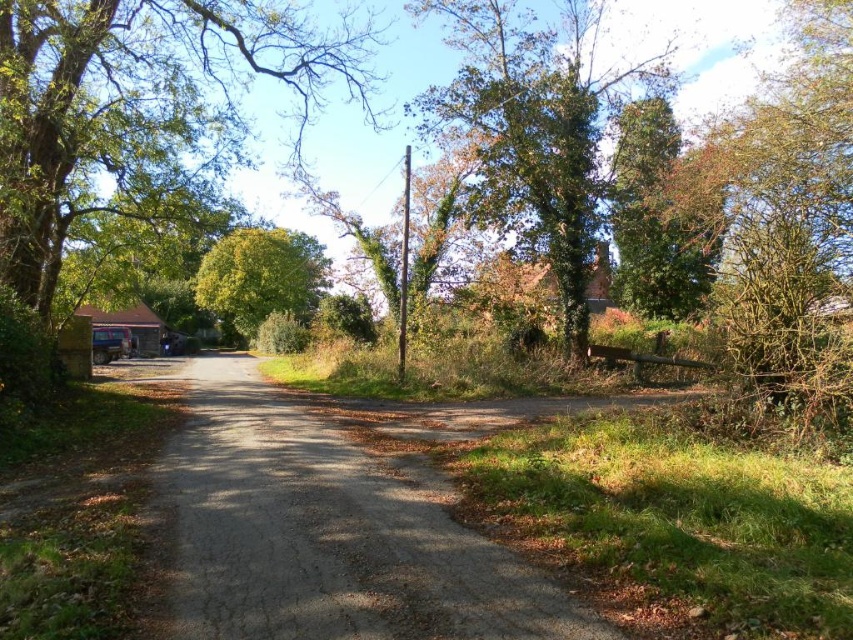
In the scene shown: Can you confirm if green leafy tree at left is smaller than green leafy tree at center?

Actually, green leafy tree at left might be larger than green leafy tree at center.

Which is in front, point (70, 202) or point (285, 273)?

Point (70, 202) is in front.

You are a GUI agent. You are given a task and a screenshot of the screen. Output one action in this format:
    pyautogui.click(x=<x>, y=<y>)
    Task: Click on the green leafy tree at left
    
    Given the screenshot: What is the action you would take?
    pyautogui.click(x=132, y=104)

Between point (161, 483) and point (149, 164), which one is positioned behind?

The point (149, 164) is more distant.

Is point (320, 529) behind point (171, 77)?

That is False.

Identify the location of gray gravel road at center. (326, 532).

Can you confirm if gray gravel road at center is shorter than green leafy tree at upper center?

Indeed, gray gravel road at center has a lesser height compared to green leafy tree at upper center.

Is gray gravel road at center above green leafy tree at upper center?

No, gray gravel road at center is not above green leafy tree at upper center.

Who is more distant from viewer, (x=184, y=557) or (x=561, y=323)?

The point (x=561, y=323) is behind.

Identify the location of gray gravel road at center. (326, 532).